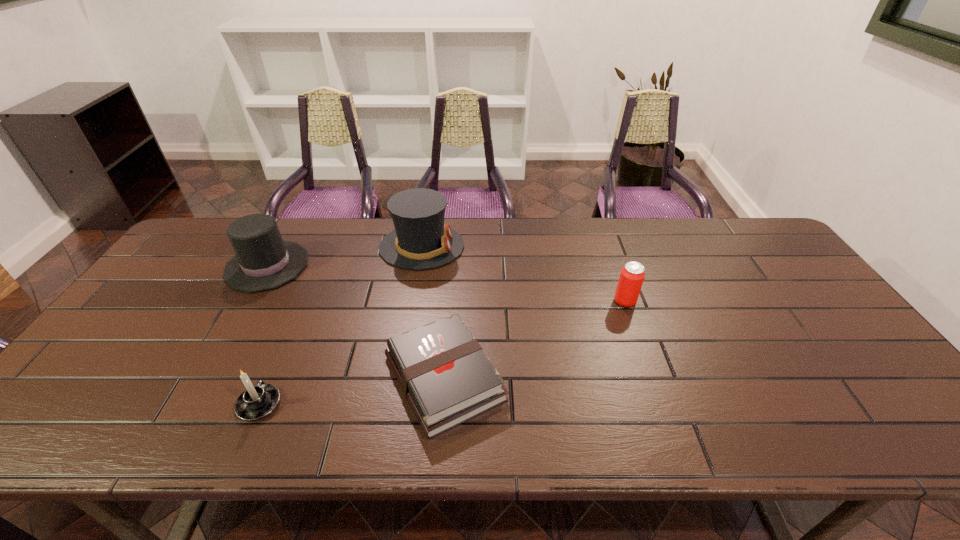
The width and height of the screenshot is (960, 540). I want to click on free space between the left dress hat and the hardback book, so click(x=356, y=322).

Locate which object is the fourth closest to the right dress hat. Please provide its 2D coordinates. Your answer should be formatted as a tuple, i.e. [(x, y)], where the tuple contains the x and y coordinates of a point satisfying the conditions above.

[(632, 275)]

At what (x,y) coordinates should I click in order to perform the action: click on object that can be found as the third closest to the hardback book. Please return your answer as a coordinate pair (x, y). This screenshot has width=960, height=540. Looking at the image, I should click on (632, 275).

The width and height of the screenshot is (960, 540). I want to click on free space that satisfies the following two spatial constraints: 1. with goggles on the front of the third farthest object; 2. on the left side of the right dress hat, so click(413, 301).

Where is `vacant space that satisfies the following two spatial constraints: 1. with a handle on the side of the rightmost object; 2. on the right side of the candle holder`? This screenshot has width=960, height=540. vacant space that satisfies the following two spatial constraints: 1. with a handle on the side of the rightmost object; 2. on the right side of the candle holder is located at coordinates (303, 301).

You are a GUI agent. You are given a task and a screenshot of the screen. Output one action in this format:
    pyautogui.click(x=<x>, y=<y>)
    Task: Click on the free space that satisfies the following two spatial constraints: 1. on the front of the left dress hat with the decoration; 2. with a handle on the side of the candle holder
    
    Given the screenshot: What is the action you would take?
    pyautogui.click(x=188, y=404)

The width and height of the screenshot is (960, 540). I want to click on free location that satisfies the following two spatial constraints: 1. with a handle on the side of the third nearest object; 2. on the right side of the candle holder, so click(x=303, y=301).

This screenshot has height=540, width=960. Identify the location of vacant space that satisfies the following two spatial constraints: 1. with a handle on the side of the shortest object; 2. on the right side of the candle holder. (271, 378).

Find the location of a particular element. The image size is (960, 540). free spot that satisfies the following two spatial constraints: 1. on the back side of the hardback book; 2. on the front of the left dress hat with the decoration is located at coordinates (452, 266).

The height and width of the screenshot is (540, 960). In order to click on free region that satisfies the following two spatial constraints: 1. on the front of the left dress hat with the decoration; 2. on the right side of the rightmost object in this screenshot , I will do `click(247, 301)`.